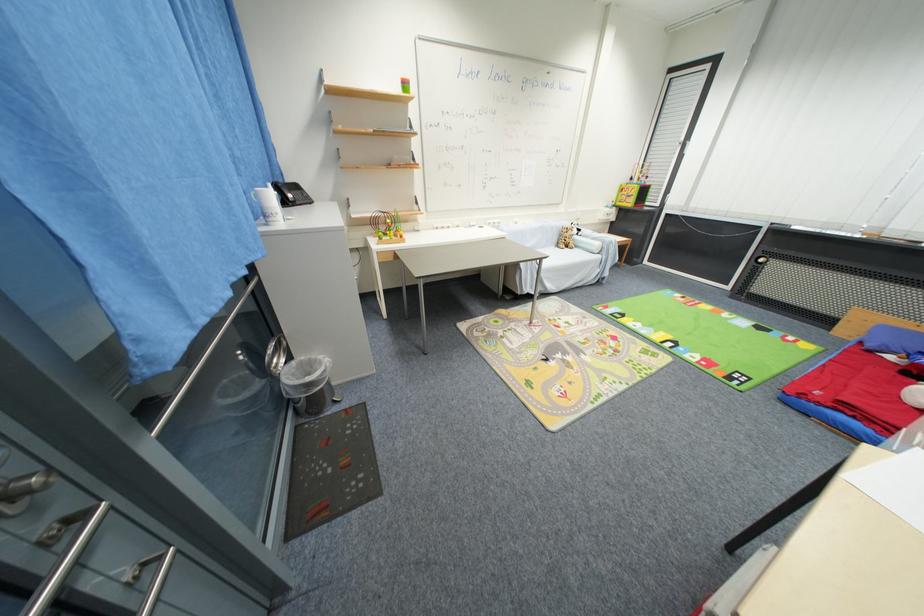
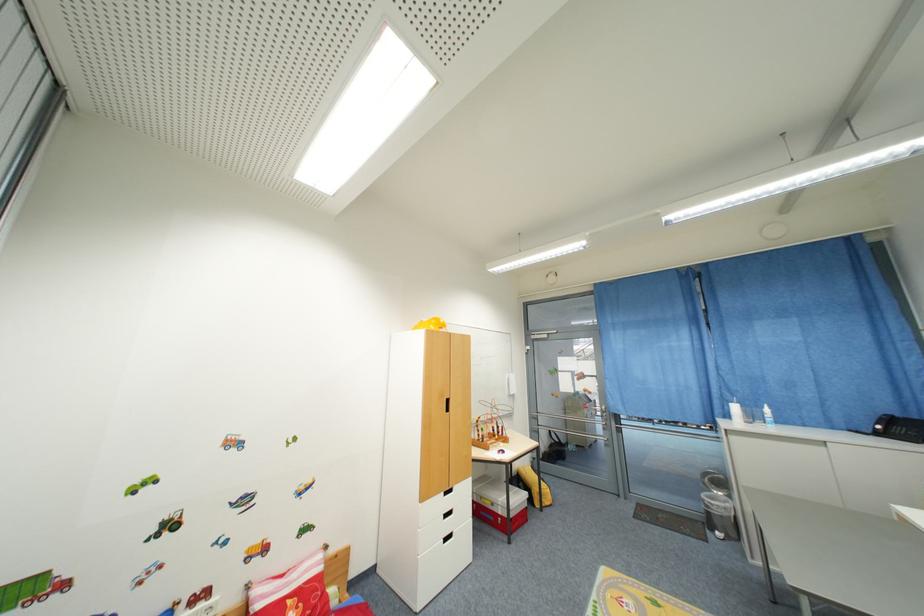
Question: I am providing you with two images of the same scene from different viewpoints. After the viewpoint changes to image2, which objects are now occluded?

Choices:
 (A) orange drawer handle
 (B) metal door handle
 (C) telephone handset
 (D) black cabinet handle

Answer: (C)